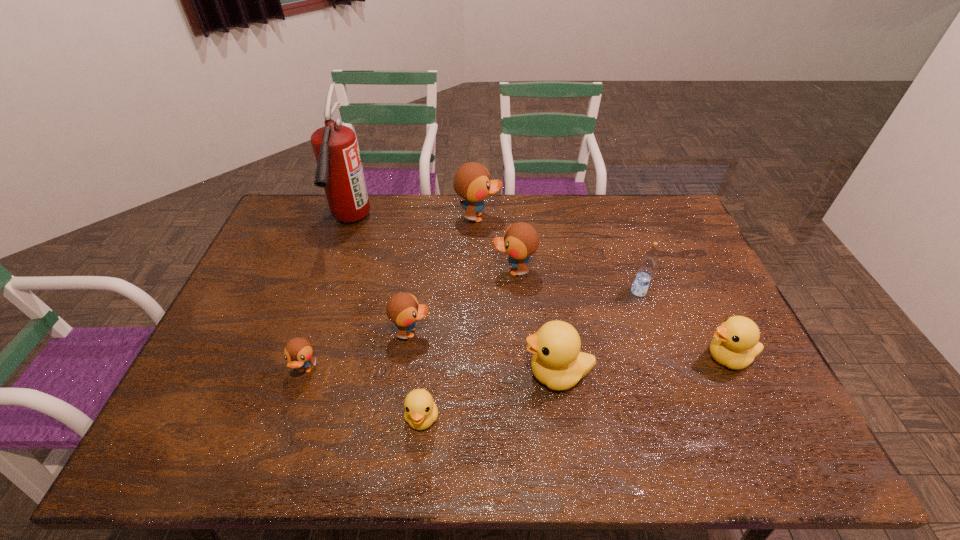
In order to click on free point located 0.260m on the front-facing side of the third farthest object in this screenshot , I will do `click(410, 271)`.

Find the location of a particular element. Image resolution: width=960 pixels, height=540 pixels. free space located 0.350m on the front-facing side of the third farthest object is located at coordinates (382, 271).

Image resolution: width=960 pixels, height=540 pixels. In order to click on vacant space positioned on the front-facing side of the third farthest object in this screenshot , I will do `click(388, 271)`.

Locate an element on the screen. The image size is (960, 540). vacant space situated on the face of the biggest yellow duck is located at coordinates (503, 374).

Image resolution: width=960 pixels, height=540 pixels. I want to click on free space located 0.320m on the face of the biggest yellow duck, so click(397, 374).

You are a GUI agent. You are given a task and a screenshot of the screen. Output one action in this format:
    pyautogui.click(x=<x>, y=<y>)
    Task: Click on the free space located on the face of the biggest yellow duck
    The width and height of the screenshot is (960, 540).
    Given the screenshot: What is the action you would take?
    pyautogui.click(x=418, y=374)

Image resolution: width=960 pixels, height=540 pixels. I want to click on vacant position located 0.180m on the front-facing side of the third farthest blue duck, so click(x=496, y=332).

At what (x,y) coordinates should I click in order to perform the action: click on vacant space located 0.110m on the face of the rightmost yellow duck. Please return your answer as a coordinate pair (x, y). Looking at the image, I should click on (660, 357).

Locate an element on the screen. This screenshot has height=540, width=960. vacant space located 0.100m on the face of the rightmost yellow duck is located at coordinates (663, 357).

This screenshot has width=960, height=540. I want to click on free region located on the face of the rightmost yellow duck, so click(x=656, y=357).